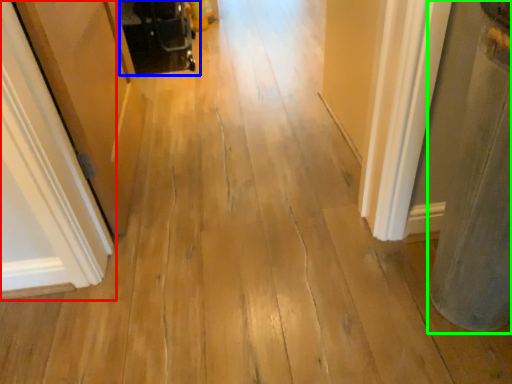
Question: Estimate the real-world distances between objects in this image. Which object is farther from door (highlighted by a red box), baby carriage (highlighted by a blue box) or pillar (highlighted by a green box)?

Choices:
 (A) baby carriage
 (B) pillar

Answer: (A)